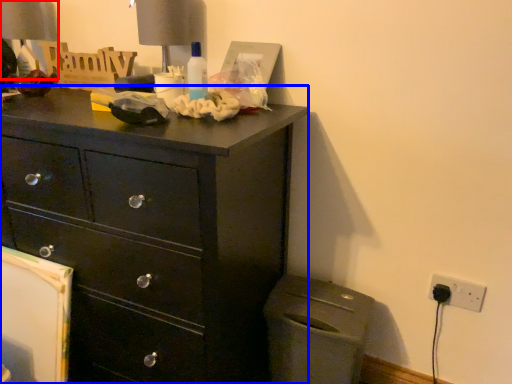
Question: Which object is further to the camera taking this photo, table lamp (highlighted by a red box) or chest of drawers (highlighted by a blue box)?

Choices:
 (A) table lamp
 (B) chest of drawers

Answer: (A)